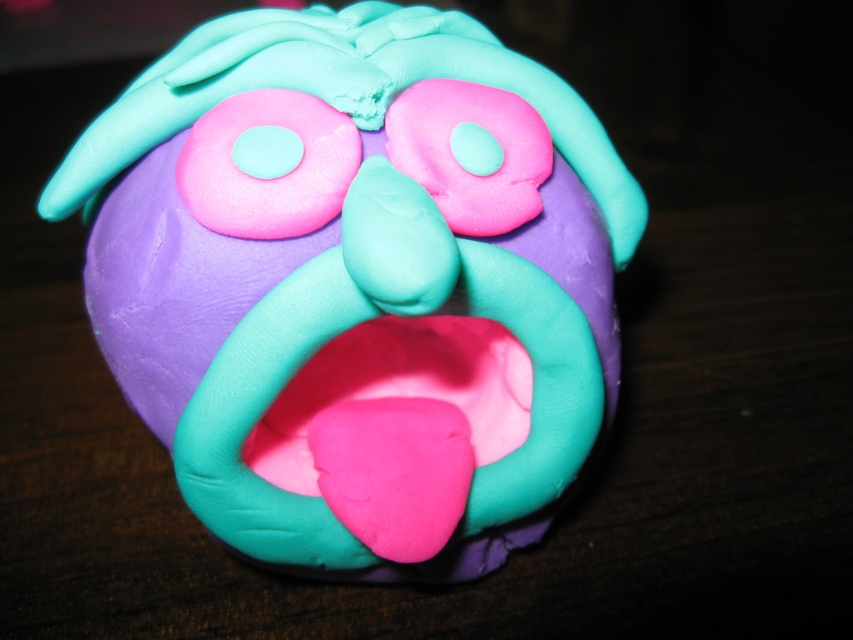
Question: Can you confirm if matte clay face at center is smaller than pink matte donut at upper center?

Choices:
 (A) yes
 (B) no

Answer: (B)

Question: Which point is closer to the camera taking this photo?

Choices:
 (A) coord(207,208)
 (B) coord(575,316)

Answer: (A)

Question: Can you confirm if matte clay face at center is positioned to the right of pink matte donut at upper center?

Choices:
 (A) no
 (B) yes

Answer: (B)

Question: Which of the following is the closest to the observer?

Choices:
 (A) pink matte donut at upper center
 (B) matte clay face at center

Answer: (B)

Question: Among these objects, which one is farthest from the camera?

Choices:
 (A) pink matte donut at upper center
 (B) matte clay face at center

Answer: (A)

Question: Where is matte clay face at center located in relation to pink matte donut at upper center in the image?

Choices:
 (A) left
 (B) right

Answer: (B)